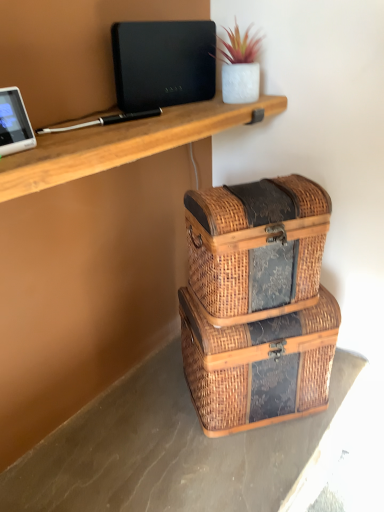
How much space does woven wood trunk at center, the first storage box in the top-to-bottom sequence, occupy vertically?

woven wood trunk at center, the first storage box in the top-to-bottom sequence, is 10.18 inches in height.

The height and width of the screenshot is (512, 384). Describe the element at coordinates (14, 123) in the screenshot. I see `white glossy tablet at upper left` at that location.

What do you see at coordinates (166, 450) in the screenshot? Image resolution: width=384 pixels, height=512 pixels. I see `brown wicker baskets at lower right` at bounding box center [166, 450].

This screenshot has width=384, height=512. Describe the element at coordinates (163, 63) in the screenshot. I see `black matte laptop at upper center` at that location.

Where is `woven wood trunk at center, the first storage box in the top-to-bottom sequence`? This screenshot has width=384, height=512. woven wood trunk at center, the first storage box in the top-to-bottom sequence is located at coordinates (256, 247).

Considering the sizes of black matte laptop at upper center and white glossy tablet at upper left in the image, is black matte laptop at upper center wider or thinner than white glossy tablet at upper left?

Considering their sizes, black matte laptop at upper center looks slimmer than white glossy tablet at upper left.

In the image, is black matte laptop at upper center positioned in front of or behind white glossy tablet at upper left?

black matte laptop at upper center is positioned farther from the viewer than white glossy tablet at upper left.

Which of these two, black matte laptop at upper center or white glossy tablet at upper left, is bigger?

black matte laptop at upper center is bigger.

This screenshot has height=512, width=384. In order to click on laptop above the white glossy tablet at upper left (from the image's perspective) in this screenshot , I will do `click(163, 63)`.

From the picture: Is woven wood storage box at lower center, the 2th storage box positioned from the top, at the back of brown wicker baskets at lower right?

That's not correct — brown wicker baskets at lower right is not looking away from woven wood storage box at lower center, the 2th storage box positioned from the top.

Is brown wicker baskets at lower right located outside woven wood storage box at lower center, the 2th storage box positioned from the top?

Yes.

Identify the location of the 1st storage box above the brown wicker baskets at lower right (from a real-world perspective). The height and width of the screenshot is (512, 384). (258, 365).

Which object is positioned more to the left, brown wicker baskets at lower right or woven wood storage box at lower center, the 2th storage box positioned from the top?

brown wicker baskets at lower right is more to the left.

Based on their sizes in the image, would you say white glossy tablet at upper left is bigger or smaller than brown wicker baskets at lower right?

Clearly, white glossy tablet at upper left is smaller in size than brown wicker baskets at lower right.

Which point is more distant from viewer, (x=6, y=104) or (x=161, y=352)?

Point (x=161, y=352)

From a real-world perspective, which is physically below, white glossy tablet at upper left or brown wicker baskets at lower right?

brown wicker baskets at lower right is physically lower.

From the image's perspective, who appears lower, white glossy tablet at upper left or brown wicker baskets at lower right?

brown wicker baskets at lower right.

Is black matte laptop at upper center surrounded by woven wood trunk at center, arranged as the second storage box when ordered from the bottom?

No, black matte laptop at upper center is not inside woven wood trunk at center, arranged as the second storage box when ordered from the bottom.

Is woven wood trunk at center, the first storage box in the top-to-bottom sequence, shorter than black matte laptop at upper center?

No, woven wood trunk at center, the first storage box in the top-to-bottom sequence, is not shorter than black matte laptop at upper center.

Is woven wood trunk at center, the first storage box in the top-to-bottom sequence, with black matte laptop at upper center?

No.

Based on the photo, can you confirm if woven wood trunk at center, the first storage box in the top-to-bottom sequence, is smaller than black matte laptop at upper center?

Actually, woven wood trunk at center, the first storage box in the top-to-bottom sequence, might be larger than black matte laptop at upper center.

Is black matte laptop at upper center located within woven wood storage box at lower center, the 2th storage box positioned from the top?

No, black matte laptop at upper center is not surrounded by woven wood storage box at lower center, the 2th storage box positioned from the top.

In the scene shown: Considering the relative sizes of woven wood storage box at lower center, the 1th storage box ordered from the bottom, and black matte laptop at upper center in the image provided, is woven wood storage box at lower center, the 1th storage box ordered from the bottom, shorter than black matte laptop at upper center?

No.

Is the position of woven wood storage box at lower center, the 2th storage box positioned from the top, more distant than that of black matte laptop at upper center?

Yes, the depth of woven wood storage box at lower center, the 2th storage box positioned from the top, is greater than that of black matte laptop at upper center.

Is woven wood storage box at lower center, the 2th storage box positioned from the top, not close to black matte laptop at upper center?

No, there isn't a large distance between woven wood storage box at lower center, the 2th storage box positioned from the top, and black matte laptop at upper center.

Are brown wicker baskets at lower right and black matte laptop at upper center making contact?

brown wicker baskets at lower right and black matte laptop at upper center are not in contact.

Does brown wicker baskets at lower right have a greater width compared to black matte laptop at upper center?

Correct, the width of brown wicker baskets at lower right exceeds that of black matte laptop at upper center.

Consider the image. Does brown wicker baskets at lower right turn towards black matte laptop at upper center?

No, brown wicker baskets at lower right is not oriented towards black matte laptop at upper center.

Is brown wicker baskets at lower right surrounding black matte laptop at upper center?

Actually, black matte laptop at upper center is outside brown wicker baskets at lower right.

Between point (8, 99) and point (207, 295), which one is positioned in front?

The point (8, 99) is in front.

Considering the relative positions of white glossy tablet at upper left and woven wood trunk at center, arranged as the second storage box when ordered from the bottom, in the image provided, is white glossy tablet at upper left in front of woven wood trunk at center, arranged as the second storage box when ordered from the bottom,?

Yes, white glossy tablet at upper left is closer to the camera.

Are white glossy tablet at upper left and woven wood trunk at center, the first storage box in the top-to-bottom sequence, making contact?

No, white glossy tablet at upper left is not making contact with woven wood trunk at center, the first storage box in the top-to-bottom sequence.

Locate an element on the screen. The width and height of the screenshot is (384, 512). tablet computer on the left of black matte laptop at upper center is located at coordinates (14, 123).

At what (x,y) coordinates should I click in order to perform the action: click on concrete below the woven wood storage box at lower center, the 1th storage box ordered from the bottom (from a real-world perspective). Please return your answer as a coordinate pair (x, y). This screenshot has width=384, height=512. Looking at the image, I should click on (166, 450).

Considering their positions, is black matte laptop at upper center positioned closer to brown wicker baskets at lower right than white glossy tablet at upper left?

white glossy tablet at upper left is closer to brown wicker baskets at lower right.

When comparing their distances from black matte laptop at upper center, does brown wicker baskets at lower right or white glossy tablet at upper left seem further?

brown wicker baskets at lower right is further to black matte laptop at upper center.

Based on their spatial positions, is brown wicker baskets at lower right or black matte laptop at upper center further from woven wood trunk at center, arranged as the second storage box when ordered from the bottom?

brown wicker baskets at lower right.

From the image, which object appears to be nearer to woven wood trunk at center, arranged as the second storage box when ordered from the bottom, black matte laptop at upper center or brown wicker baskets at lower right?

Based on the image, black matte laptop at upper center appears to be nearer to woven wood trunk at center, arranged as the second storage box when ordered from the bottom.

Which object lies nearer to the anchor point woven wood storage box at lower center, the 1th storage box ordered from the bottom, brown wicker baskets at lower right or woven wood trunk at center, the first storage box in the top-to-bottom sequence?

woven wood trunk at center, the first storage box in the top-to-bottom sequence, is closer to woven wood storage box at lower center, the 1th storage box ordered from the bottom.

Considering their positions, is black matte laptop at upper center positioned further to woven wood storage box at lower center, the 1th storage box ordered from the bottom, than brown wicker baskets at lower right?

black matte laptop at upper center is further to woven wood storage box at lower center, the 1th storage box ordered from the bottom.

When comparing their distances from black matte laptop at upper center, does woven wood storage box at lower center, the 1th storage box ordered from the bottom, or white glossy tablet at upper left seem closer?

Based on the image, white glossy tablet at upper left appears to be nearer to black matte laptop at upper center.

When comparing their distances from brown wicker baskets at lower right, does woven wood trunk at center, arranged as the second storage box when ordered from the bottom, or white glossy tablet at upper left seem further?

white glossy tablet at upper left is positioned further to the anchor brown wicker baskets at lower right.

In order to click on storage box between black matte laptop at upper center and woven wood storage box at lower center, the 2th storage box positioned from the top, vertically in this screenshot , I will do `click(256, 247)`.

Locate an element on the screen. storage box located between white glossy tablet at upper left and woven wood storage box at lower center, the 1th storage box ordered from the bottom, in the left-right direction is located at coordinates (256, 247).

This screenshot has height=512, width=384. I want to click on laptop between white glossy tablet at upper left and woven wood trunk at center, the first storage box in the top-to-bottom sequence, so click(163, 63).

The height and width of the screenshot is (512, 384). Find the location of `tablet computer between black matte laptop at upper center and brown wicker baskets at lower right in the up-down direction`. tablet computer between black matte laptop at upper center and brown wicker baskets at lower right in the up-down direction is located at coordinates (14, 123).